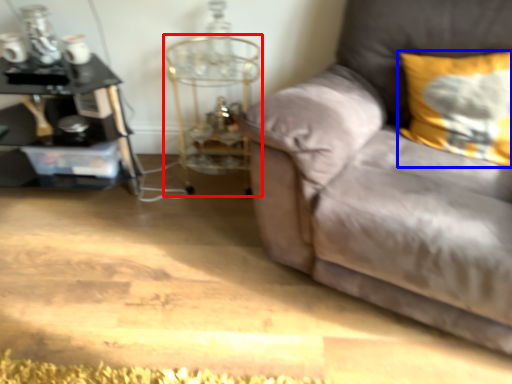
Question: Among these objects, which one is nearest to the camera, side table (highlighted by a red box) or pillow (highlighted by a blue box)?

Choices:
 (A) side table
 (B) pillow

Answer: (B)